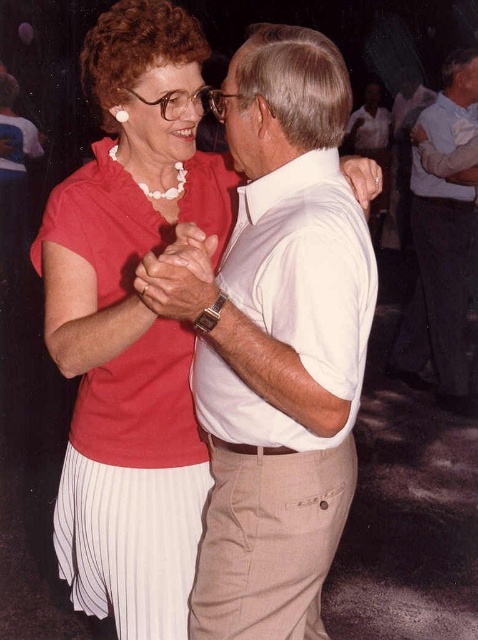
You are a photographer setting up for a dance photoshoot. You have two outfits to feature in the image. The matte red dress at center and the white cotton shirt at upper center. Based on their widths, which outfit would be better suited for a tight dance move that requires flexibility? Explain your choice using the given information.

The matte red dress at center is thinner than the white cotton shirt at upper center. Therefore, the matte red dress at center would be better suited for a tight dance move requiring flexibility because its narrower width allows for easier movement and less bulk to hinder the dancer.

You are a photographer trying to capture the best angle of the dancing couple. You notice two points in the image labeled as point [188,218] and point [444,314]. Which point is more suitable for focusing on to ensure the subject is sharp and in the foreground?

Point [188,218] is closer to the viewer than point [444,314], so focusing on point [188,218] will ensure the subject is sharp and in the foreground.